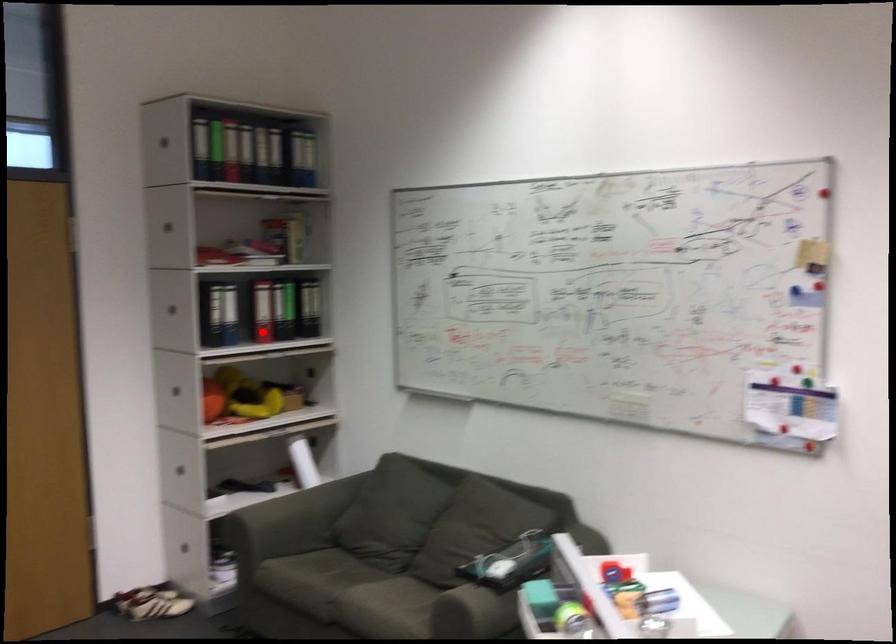
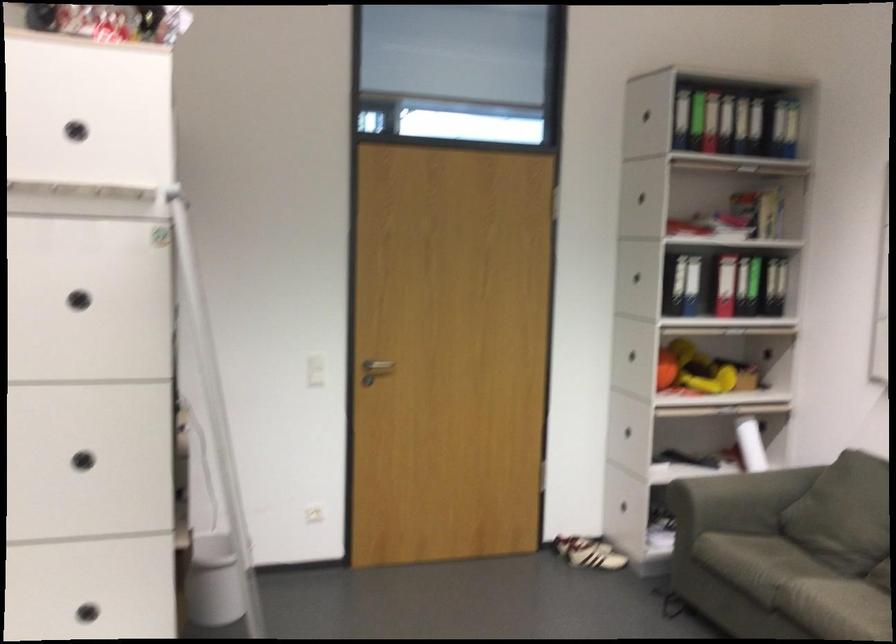
The point at the highlighted location is marked in the first image. Where is the corresponding point in the second image?

(725, 285)